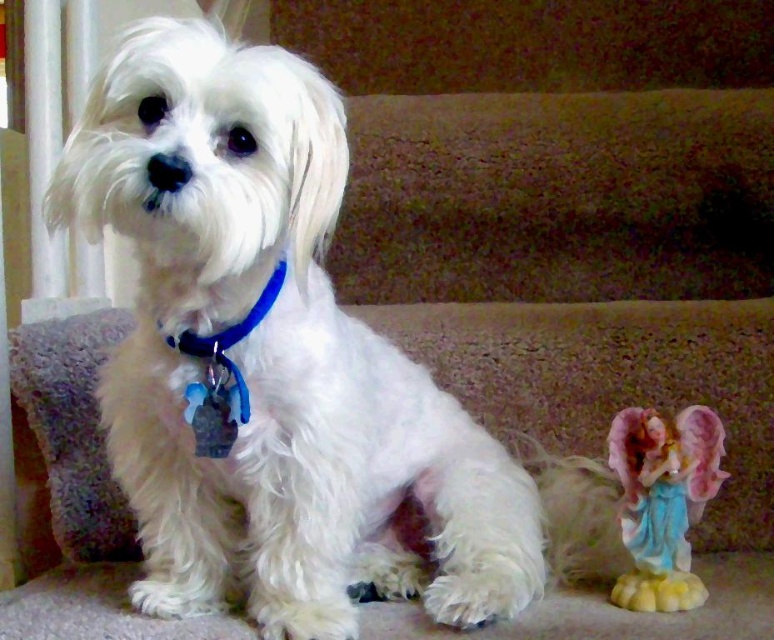
Is point (283, 173) positioned before point (718, 442)?

Yes, it is in front of point (718, 442).

Is white fluffy dog at center wider than porcelain angel at lower right?

Indeed, white fluffy dog at center has a greater width compared to porcelain angel at lower right.

Between point (519, 538) and point (682, 532), which one is positioned in front?

Point (682, 532) is more forward.

Locate an element on the screen. This screenshot has height=640, width=774. white fluffy dog at center is located at coordinates (272, 358).

Who is lower down, white fluffy dog at center or blue plastic collar at center?

white fluffy dog at center is lower down.

Between white fluffy dog at center and blue plastic collar at center, which one appears on the right side from the viewer's perspective?

Positioned to the right is blue plastic collar at center.

Does point (310, 426) come behind point (201, 444)?

No, (310, 426) is in front of (201, 444).

Image resolution: width=774 pixels, height=640 pixels. Find the location of `white fluffy dog at center`. white fluffy dog at center is located at coordinates (272, 358).

Which of these two, porcelain angel at lower right or blue plastic collar at center, stands taller?

porcelain angel at lower right is taller.

Is porcelain angel at lower right further to camera compared to blue plastic collar at center?

That is True.

Is point (642, 467) positioned in front of point (185, 410)?

No, (642, 467) is behind (185, 410).

This screenshot has height=640, width=774. What are the coordinates of `porcelain angel at lower right` in the screenshot? It's located at (663, 500).